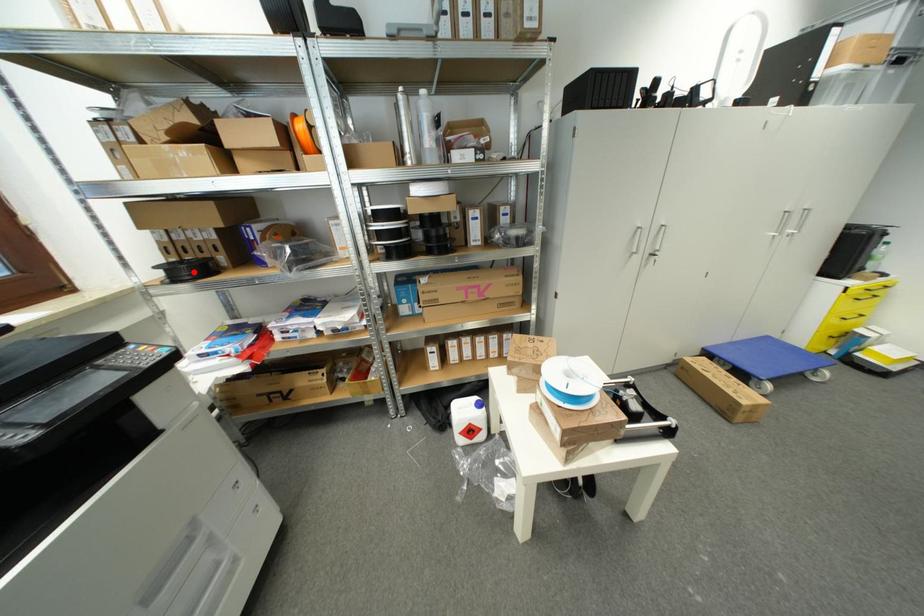
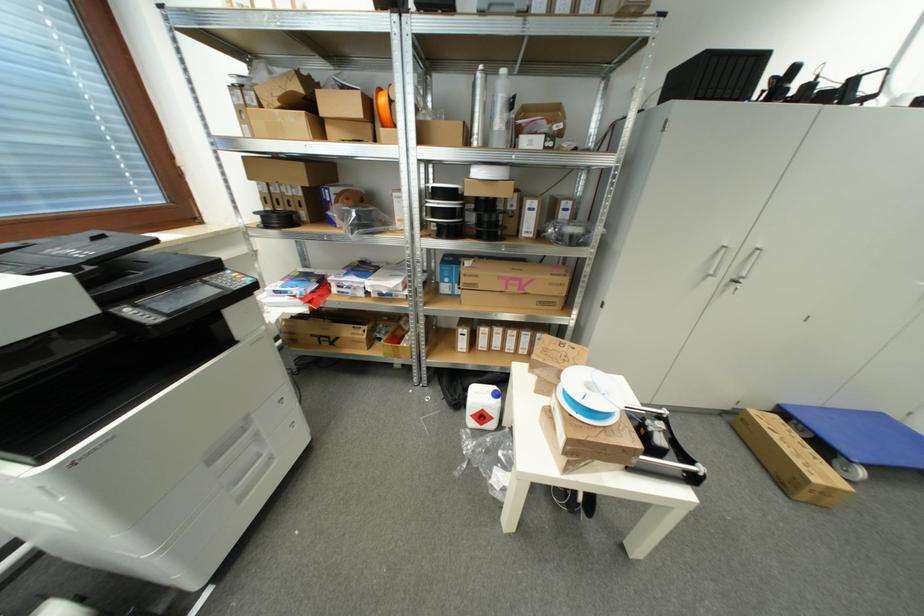
Locate, in the second image, the point that corresponds to the highlighted location in the first image.

(283, 222)